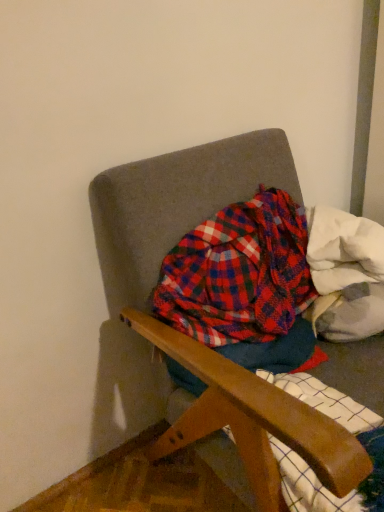
Question: Considering the positions of plaid fabric at center and textured fabric chair at center in the image, is plaid fabric at center wider or thinner than textured fabric chair at center?

Choices:
 (A) wide
 (B) thin

Answer: (B)

Question: Is plaid fabric at center in front of or behind textured fabric chair at center in the image?

Choices:
 (A) behind
 (B) front

Answer: (A)

Question: Based on their relative distances, which object is nearer to the plaid fabric at center?

Choices:
 (A) textured fabric chair at center
 (B) white fluffy blanket at upper right

Answer: (B)

Question: Which is nearer to the plaid fabric at center?

Choices:
 (A) textured fabric chair at center
 (B) white fluffy blanket at upper right

Answer: (B)